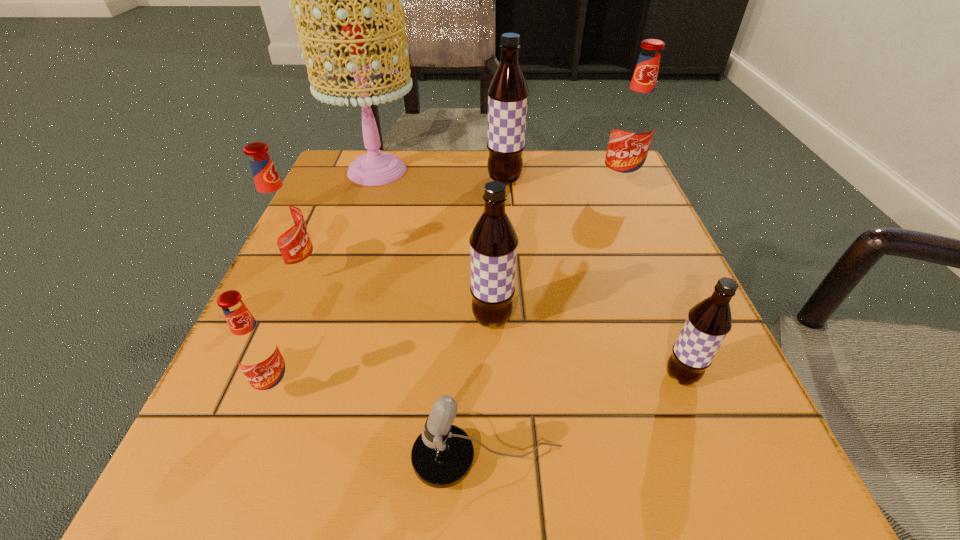
You are a GUI agent. You are given a task and a screenshot of the screen. Output one action in this format:
    pyautogui.click(x=<x>, y=<y>)
    Task: Click on the empty location between the farthest brown root beer and the smallest red root beer
    This screenshot has width=960, height=540.
    Given the screenshot: What is the action you would take?
    pyautogui.click(x=391, y=285)

Where is `empty location between the rightmost red root beer and the biggest brown root beer`? Image resolution: width=960 pixels, height=540 pixels. empty location between the rightmost red root beer and the biggest brown root beer is located at coordinates (562, 184).

The height and width of the screenshot is (540, 960). Identify the location of the seventh closest object to the smallest brown root beer. (374, 168).

Locate an element on the screen. The height and width of the screenshot is (540, 960). the third closest object to the biggest brown root beer is located at coordinates [x=493, y=242].

Select which root beer appears as the fourth closest to the nearest red root beer. Please provide its 2D coordinates. Your answer should be formatted as a tuple, i.e. [(x, y)], where the tuple contains the x and y coordinates of a point satisfying the conditions above.

[(508, 92)]

Image resolution: width=960 pixels, height=540 pixels. I want to click on the fifth closest root beer to the lampshade, so (255, 349).

I want to click on red root beer identified as the third closest to the second farthest brown root beer, so click(x=633, y=125).

I want to click on red root beer that is the closest to the second biggest red root beer, so click(255, 349).

Identify which brown root beer is the closest to the smallest brown root beer. Please provide its 2D coordinates. Your answer should be formatted as a tuple, i.e. [(x, y)], where the tuple contains the x and y coordinates of a point satisfying the conditions above.

[(493, 242)]

The width and height of the screenshot is (960, 540). I want to click on the second closest brown root beer to the nearest brown root beer, so click(x=508, y=92).